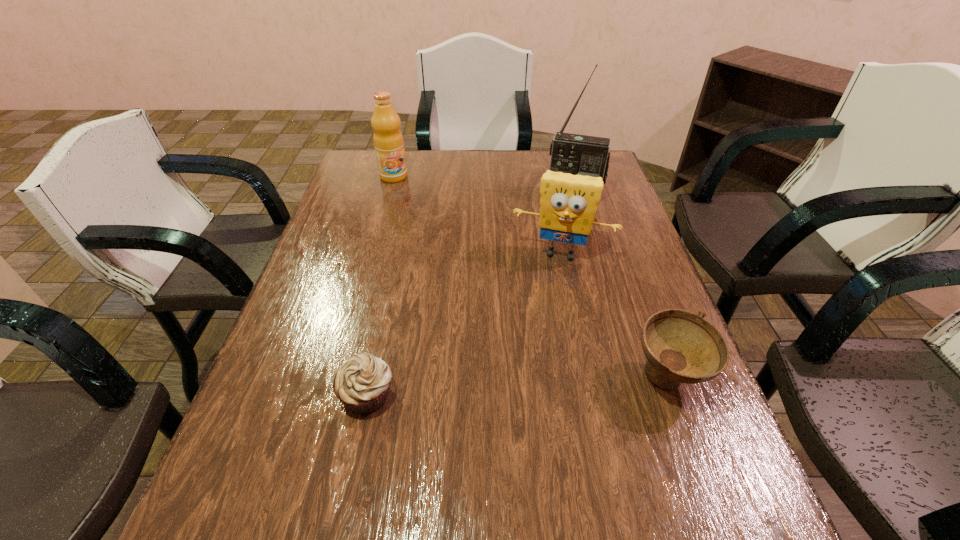
Find the location of a particular element. This screenshot has height=540, width=960. vacant space on the desktop that is between the shortest object and the soup bowl and is positioned on the display of the radio receiver is located at coordinates (525, 386).

This screenshot has height=540, width=960. I want to click on vacant space on the desktop that is between the shortest object and the soup bowl and is positioned on the front label of the fourth shortest object, so click(476, 389).

You are a GUI agent. You are given a task and a screenshot of the screen. Output one action in this format:
    pyautogui.click(x=<x>, y=<y>)
    Task: Click on the vacant spot on the desktop that is between the shortest object and the soup bowl and is positioned on the face of the third tallest object
    This screenshot has height=540, width=960.
    Given the screenshot: What is the action you would take?
    pyautogui.click(x=531, y=386)